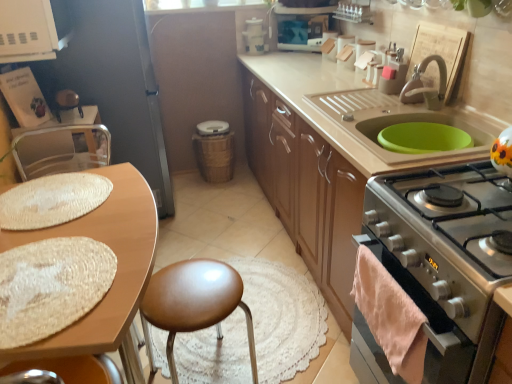
Identify the location of unoccupied region to the right of brown leather stool at center. (291, 347).